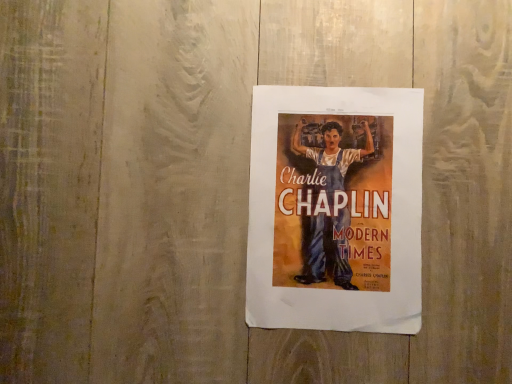
In order to face matte paper poster at center, should I rotate leftwards or rightwards?

You should rotate right by 10.505 degrees.

This screenshot has height=384, width=512. What do you see at coordinates (335, 209) in the screenshot?
I see `matte paper poster at center` at bounding box center [335, 209].

Locate an element on the screen. matte paper poster at center is located at coordinates (335, 209).

This screenshot has height=384, width=512. Identify the location of matte paper poster at center. (335, 209).